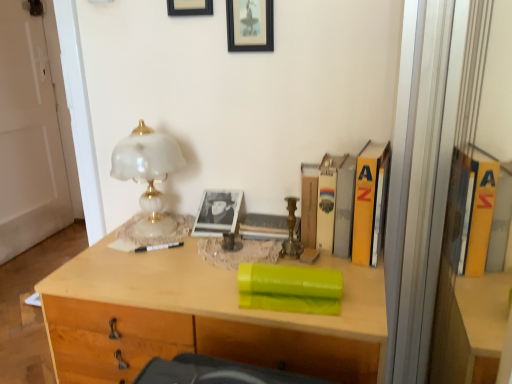
Where is `free space to the back side of black plastic pen at center`? The width and height of the screenshot is (512, 384). free space to the back side of black plastic pen at center is located at coordinates (164, 229).